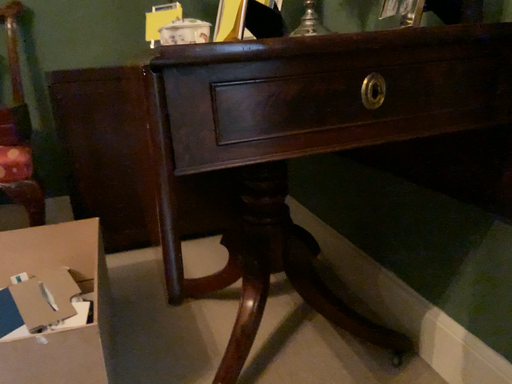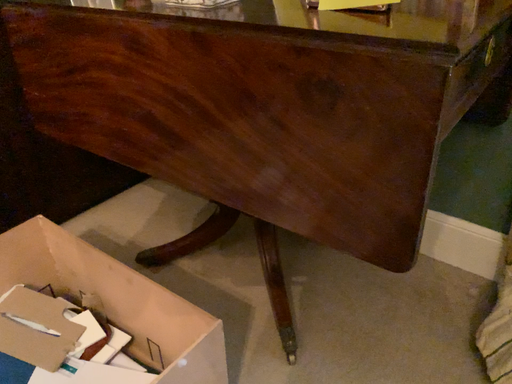
Question: How did the camera likely rotate when shooting the video?

Choices:
 (A) rotated left
 (B) rotated right

Answer: (B)